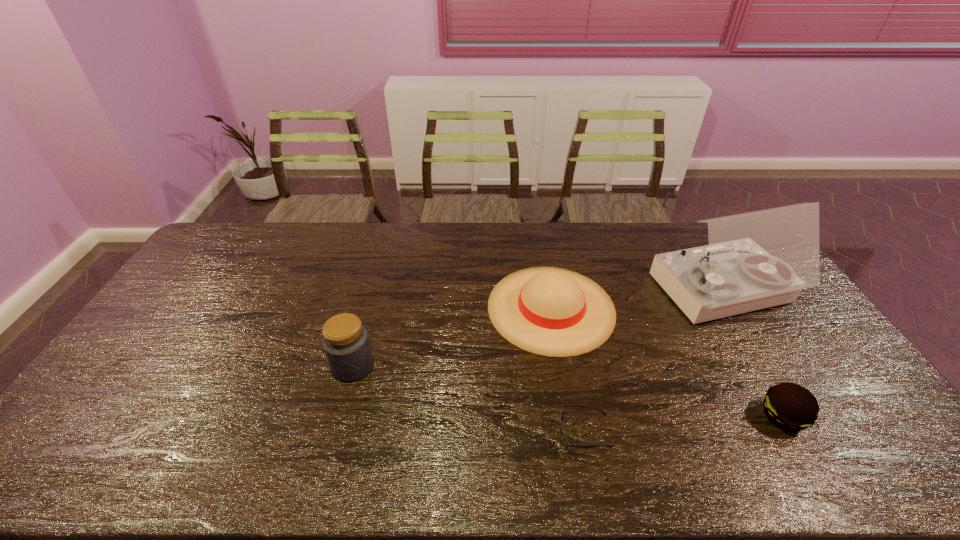
Where is `free space between the patty and the sombrero`? free space between the patty and the sombrero is located at coordinates (667, 362).

Locate an element on the screen. This screenshot has width=960, height=540. vacant space that's between the shortest object and the tallest object is located at coordinates (653, 362).

Find the location of a particular element. object that ranks as the second closest to the record player is located at coordinates (789, 406).

Locate which object is the third closest to the third tallest object. Please provide its 2D coordinates. Your answer should be formatted as a tuple, i.e. [(x, y)], where the tuple contains the x and y coordinates of a point satisfying the conditions above.

[(789, 406)]